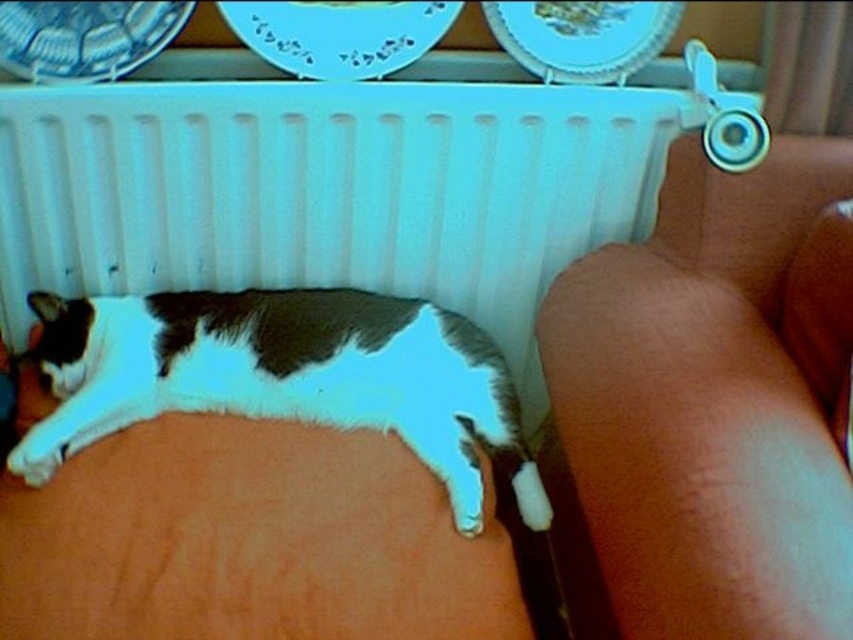
You are standing in the room and see two points marked on the wall. The first point is at position point (630, 408) and the second point is at point (370, 340). Which point is closer to you?

Point (630, 408) is in front of point (370, 340), so it is closer to you.

You are standing at the origin point in the room and want to move to the brown leather couch at lower right. Which direction should you move to reach it?

The brown leather couch at lower right is located at point (705, 410), so you should move towards the lower right direction to reach it.

You are a cat owner who wants to ensure your cat stays warm. The white plastic radiator at upper center is the only heat source in the room. Can the white fur cat at lower left reach the radiator to warm up?

The white plastic radiator at upper center is 8.33 inches away from the white fur cat at lower left, so the cat can easily reach the radiator to warm up since the distance is manageable for a cat to move towards the heat source.